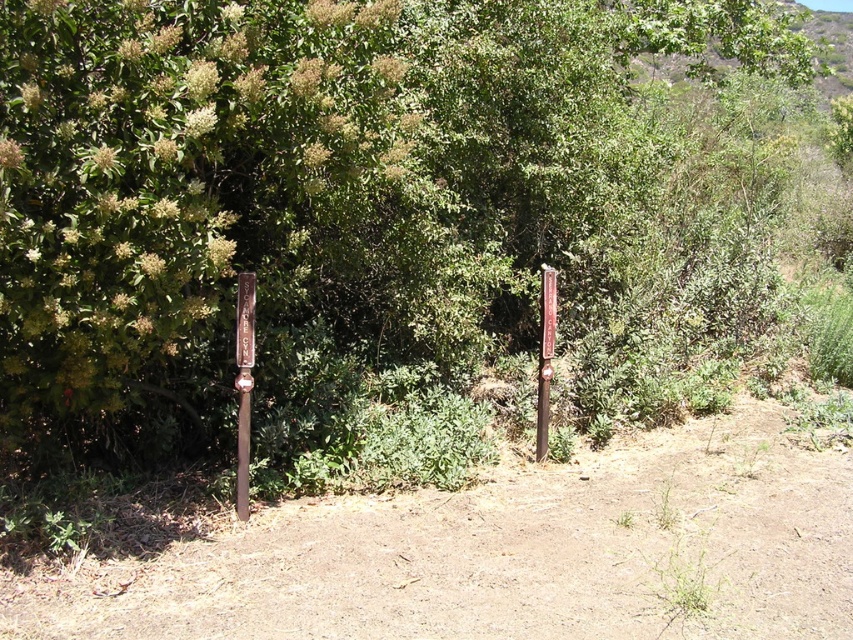
Question: Is green matte signpost at left to the left of rusty metal signpost at center-right from the viewer's perspective?

Choices:
 (A) no
 (B) yes

Answer: (B)

Question: Which of the following is the farthest from the observer?

Choices:
 (A) brown wooden signpost at left
 (B) green leafy tree at center

Answer: (B)

Question: Which of the following is the closest to the observer?

Choices:
 (A) (236, 468)
 (B) (300, 96)

Answer: (B)

Question: Does green matte signpost at left have a smaller size compared to brown wooden signpost at left?

Choices:
 (A) no
 (B) yes

Answer: (A)

Question: Can you confirm if green leafy tree at center is thinner than brown wooden signpost at left?

Choices:
 (A) no
 (B) yes

Answer: (A)

Question: Based on their relative distances, which object is nearer to the green leafy tree at center?

Choices:
 (A) brown wooden signpost at left
 (B) green matte signpost at left
 (C) rusty metal signpost at center-right

Answer: (A)